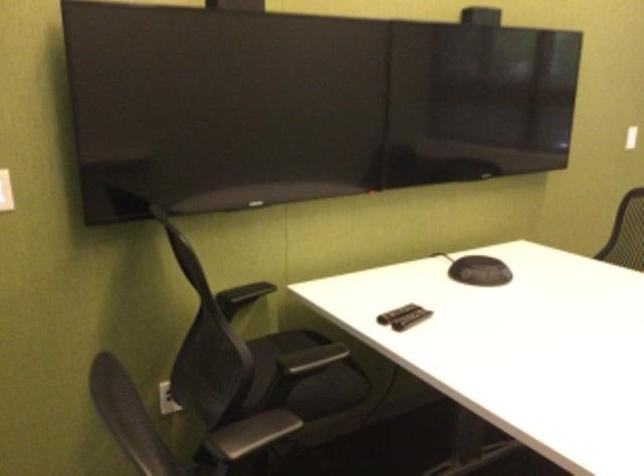
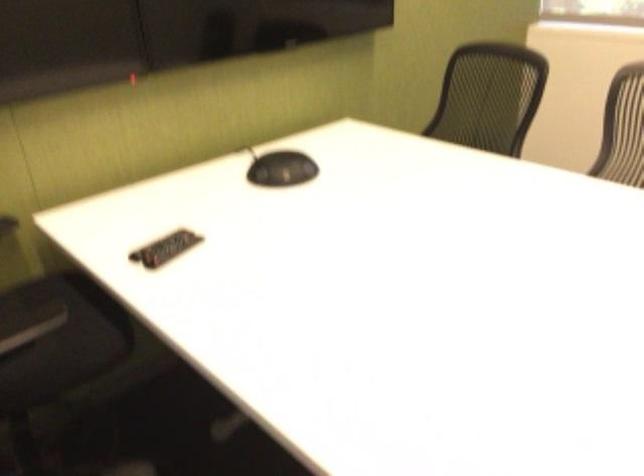
Question: How did the camera likely rotate?

Choices:
 (A) Left
 (B) Right
 (C) Up
 (D) Down

Answer: (D)